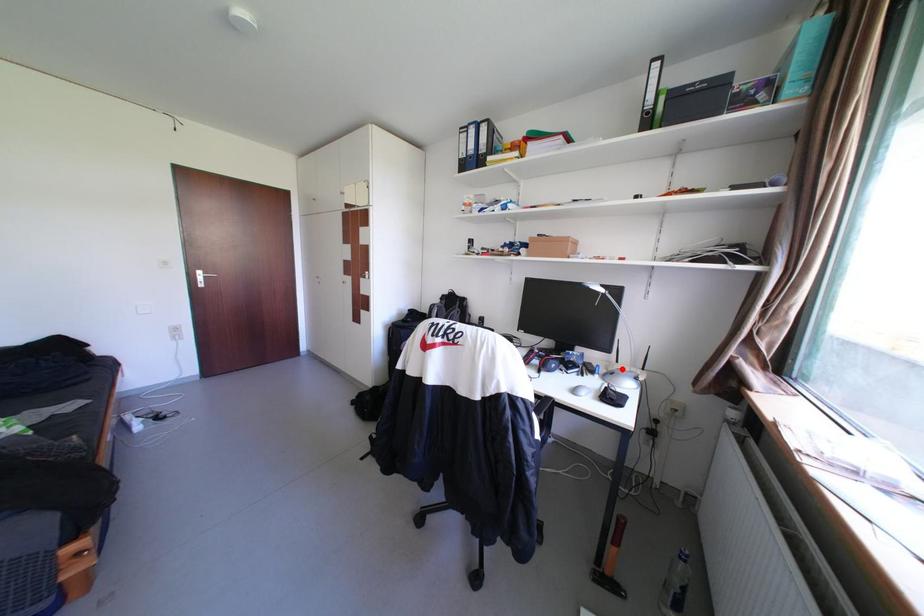
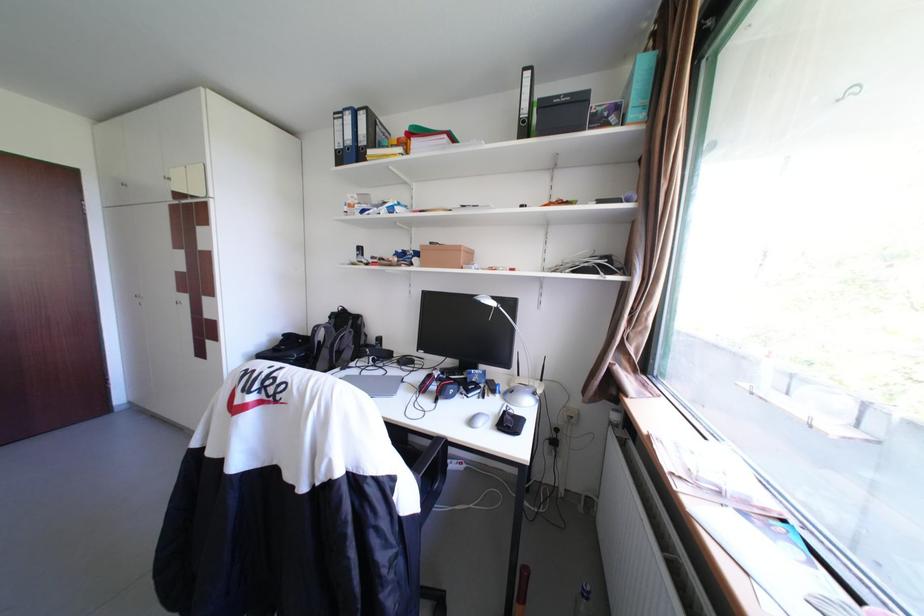
Find the pixel in the second image that matches the highlighted location in the first image.

(523, 386)